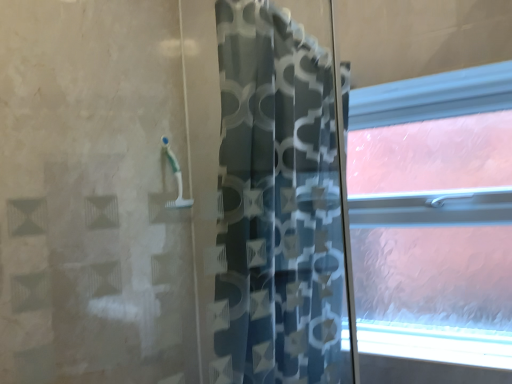
Describe the element at coordinates (278, 199) in the screenshot. The image size is (512, 384). I see `blue patterned curtain at center` at that location.

What is the approximate width of blue patterned curtain at center?

9.27 inches.

I want to click on blue patterned curtain at center, so click(x=278, y=199).

From the image's perspective, would you say white frosted glass at lower right is shown under frosted glass window at right?

Yes, from the image's perspective, white frosted glass at lower right is beneath frosted glass window at right.

Is white frosted glass at lower right looking in the opposite direction of frosted glass window at right?

Yes, white frosted glass at lower right is facing away from frosted glass window at right.

Is white frosted glass at lower right touching frosted glass window at right?

white frosted glass at lower right and frosted glass window at right are clearly separated.

Is white frosted glass at lower right positioned beyond the bounds of frosted glass window at right?

That's correct, white frosted glass at lower right is outside of frosted glass window at right.

Measure the distance from frosted glass window at right to white frosted glass at lower right.

frosted glass window at right is 10.08 inches from white frosted glass at lower right.

From the image's perspective, is frosted glass window at right on top of white frosted glass at lower right?

Yes, from the image's perspective, frosted glass window at right is on top of white frosted glass at lower right.

Which point is more forward, (x=388, y=307) or (x=360, y=323)?

Positioned in front is point (x=360, y=323).

Considering the sizes of objects frosted glass window at right and white frosted glass at lower right in the image provided, who is bigger, frosted glass window at right or white frosted glass at lower right?

frosted glass window at right.

Can you tell me how much blue patterned curtain at center and white frosted glass at lower right differ in facing direction?

90.1 degrees.

Does blue patterned curtain at center lie behind white frosted glass at lower right?

No, the depth of blue patterned curtain at center is less than that of white frosted glass at lower right.

Is blue patterned curtain at center in contact with white frosted glass at lower right?

No, blue patterned curtain at center is not touching white frosted glass at lower right.

Where is `window sill directly beneath the blue patterned curtain at center (from a real-world perspective)`? The height and width of the screenshot is (384, 512). window sill directly beneath the blue patterned curtain at center (from a real-world perspective) is located at coordinates point(436,343).

Who is smaller, blue patterned curtain at center or frosted glass window at right?

frosted glass window at right is smaller.

Is blue patterned curtain at center taller than frosted glass window at right?

Yes.

Which of these two, blue patterned curtain at center or frosted glass window at right, is thinner?

frosted glass window at right is thinner.

Is point (326, 181) closer or farther from the camera than point (488, 140)?

Point (326, 181) is closer to the camera than point (488, 140).

From a real-world perspective, is white frosted glass at lower right physically above blue patterned curtain at center?

No, from a real-world perspective, white frosted glass at lower right is not above blue patterned curtain at center.

Is the depth of white frosted glass at lower right greater than that of blue patterned curtain at center?

Yes, the depth of white frosted glass at lower right is greater than that of blue patterned curtain at center.

Can blue patterned curtain at center be found inside white frosted glass at lower right?

Actually, blue patterned curtain at center is outside white frosted glass at lower right.

Is point (468, 337) positioned before point (339, 284)?

No, (468, 337) is behind (339, 284).

Does frosted glass window at right come in front of blue patterned curtain at center?

No, frosted glass window at right is behind blue patterned curtain at center.

In terms of width, does frosted glass window at right look wider or thinner when compared to blue patterned curtain at center?

frosted glass window at right is thinner than blue patterned curtain at center.

From the image's perspective, relative to blue patterned curtain at center, is frosted glass window at right above or below?

frosted glass window at right is situated higher than blue patterned curtain at center in the image.

Does frosted glass window at right contain blue patterned curtain at center?

No, blue patterned curtain at center is not surrounded by frosted glass window at right.

The height and width of the screenshot is (384, 512). Find the location of `window above the white frosted glass at lower right (from the image's perspective)`. window above the white frosted glass at lower right (from the image's perspective) is located at coordinates (434, 215).

Find the location of a particular element. window sill that appears below the frosted glass window at right (from the image's perspective) is located at coordinates (436, 343).

Based on the photo, from the image, which object appears to be farther from frosted glass window at right, blue patterned curtain at center or white frosted glass at lower right?

blue patterned curtain at center.

Looking at the image, which one is located closer to white frosted glass at lower right, blue patterned curtain at center or frosted glass window at right?

frosted glass window at right is closer to white frosted glass at lower right.

From the image, which object appears to be farther from frosted glass window at right, white frosted glass at lower right or blue patterned curtain at center?

blue patterned curtain at center is positioned further to the anchor frosted glass window at right.

Estimate the real-world distances between objects in this image. Which object is closer to blue patterned curtain at center, frosted glass window at right or white frosted glass at lower right?

Based on the image, white frosted glass at lower right appears to be nearer to blue patterned curtain at center.

Which object lies further to the anchor point white frosted glass at lower right, frosted glass window at right or blue patterned curtain at center?

blue patterned curtain at center is further to white frosted glass at lower right.

From the image, which object appears to be farther from blue patterned curtain at center, white frosted glass at lower right or frosted glass window at right?

frosted glass window at right is positioned further to the anchor blue patterned curtain at center.

What are the coordinates of `window sill between blue patterned curtain at center and frosted glass window at right from front to back` in the screenshot? It's located at (436, 343).